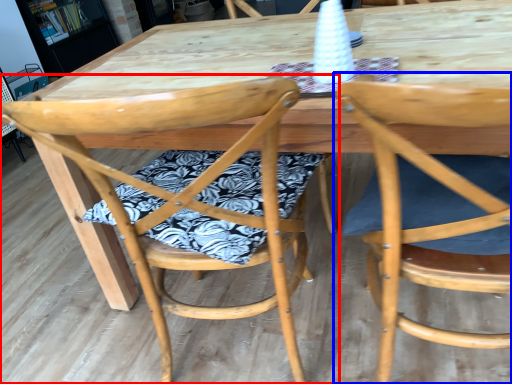
Question: Which object appears farthest to the camera in this image, chair (highlighted by a red box) or chair (highlighted by a blue box)?

Choices:
 (A) chair
 (B) chair

Answer: (A)